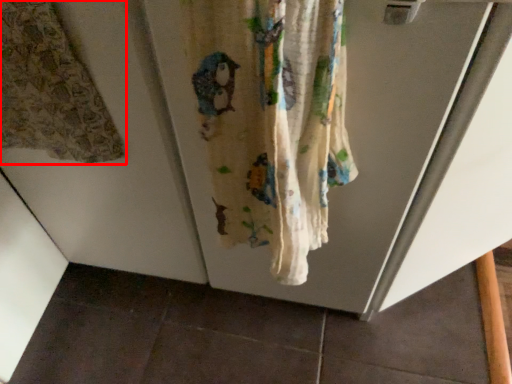
Question: From the image's perspective, considering the relative positions of curtain (annotated by the red box) and curtain in the image provided, where is curtain (annotated by the red box) located with respect to the staircase?

Choices:
 (A) below
 (B) above

Answer: (B)